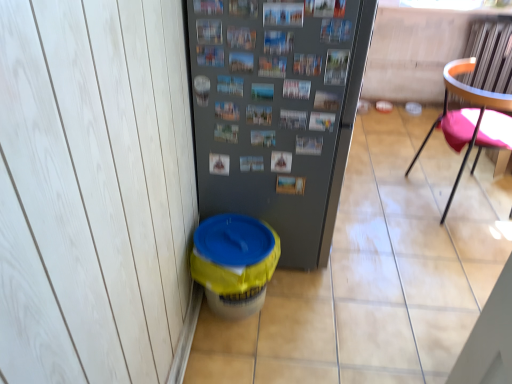
Locate an element on the screen. This screenshot has width=512, height=384. orange plastic chair at right is located at coordinates (471, 120).

Find the location of a particular element. yellow plastic potty at lower left is located at coordinates (234, 263).

At what (x,y) coordinates should I click in order to perform the action: click on orange plastic chair at right. Please return your answer as a coordinate pair (x, y). Looking at the image, I should click on (471, 120).

Would you consider yellow plastic potty at lower left to be distant from orange plastic chair at right?

yellow plastic potty at lower left is positioned a significant distance from orange plastic chair at right.

From the image's perspective, which is above, yellow plastic potty at lower left or orange plastic chair at right?

From the image's view, orange plastic chair at right is above.

Considering the positions of point (260, 222) and point (466, 61), is point (260, 222) closer or farther from the camera than point (466, 61)?

Point (260, 222) appears to be closer to the viewer than point (466, 61).

Which is correct: yellow plastic potty at lower left is inside orange plastic chair at right, or outside of it?

yellow plastic potty at lower left is not inside orange plastic chair at right, it's outside.

Looking at the image, does metallic gray refrigerator at center seem bigger or smaller compared to orange plastic chair at right?

In the image, metallic gray refrigerator at center appears to be larger than orange plastic chair at right.

Could you tell me if metallic gray refrigerator at center is facing orange plastic chair at right?

Yes.

From the image's perspective, would you say orange plastic chair at right is positioned over metallic gray refrigerator at center?

Incorrect, from the image's perspective, orange plastic chair at right is lower than metallic gray refrigerator at center.

Is orange plastic chair at right not close to metallic gray refrigerator at center?

Yes, orange plastic chair at right is far from metallic gray refrigerator at center.

Can you tell me how much orange plastic chair at right and metallic gray refrigerator at center differ in facing direction?

The angle between the facing direction of orange plastic chair at right and the facing direction of metallic gray refrigerator at center is 11.5 degrees.

Is orange plastic chair at right turned away from metallic gray refrigerator at center?

That's right, orange plastic chair at right is facing away from metallic gray refrigerator at center.

Which object is positioned more to the right, orange plastic chair at right or yellow plastic potty at lower left?

From the viewer's perspective, orange plastic chair at right appears more on the right side.

Is orange plastic chair at right positioned with its back to yellow plastic potty at lower left?

Yes.

Measure the distance from orange plastic chair at right to yellow plastic potty at lower left.

orange plastic chair at right is 4.05 feet from yellow plastic potty at lower left.

Which is more distant, (453, 133) or (252, 280)?

The point (453, 133) is farther.

Is yellow plastic potty at lower left aimed at metallic gray refrigerator at center?

No.

Considering the sizes of objects yellow plastic potty at lower left and metallic gray refrigerator at center in the image provided, who is bigger, yellow plastic potty at lower left or metallic gray refrigerator at center?

metallic gray refrigerator at center is bigger.

From a real-world perspective, is yellow plastic potty at lower left located higher than metallic gray refrigerator at center?

Incorrect, from a real-world perspective, yellow plastic potty at lower left is lower than metallic gray refrigerator at center.

Is point (198, 245) more distant than point (370, 16)?

That is True.

Which point is more forward, (347, 148) or (234, 300)?

Positioned in front is point (347, 148).

Considering the relative positions of metallic gray refrigerator at center and yellow plastic potty at lower left in the image provided, is metallic gray refrigerator at center in front of yellow plastic potty at lower left?

Yes.

From a real-world perspective, is metallic gray refrigerator at center positioned above or below yellow plastic potty at lower left?

Clearly, from a real-world perspective, metallic gray refrigerator at center is above yellow plastic potty at lower left.

Which of these two, metallic gray refrigerator at center or yellow plastic potty at lower left, is bigger?

With larger size is metallic gray refrigerator at center.

Identify the location of chair that appears above the yellow plastic potty at lower left (from the image's perspective). The height and width of the screenshot is (384, 512). (471, 120).

This screenshot has width=512, height=384. I want to click on chair that is under the metallic gray refrigerator at center (from a real-world perspective), so click(x=471, y=120).

Considering their positions, is orange plastic chair at right positioned closer to metallic gray refrigerator at center than yellow plastic potty at lower left?

yellow plastic potty at lower left.

Based on their spatial positions, is yellow plastic potty at lower left or metallic gray refrigerator at center closer to orange plastic chair at right?

metallic gray refrigerator at center is positioned closer to the anchor orange plastic chair at right.

When comparing their distances from orange plastic chair at right, does metallic gray refrigerator at center or yellow plastic potty at lower left seem further?

yellow plastic potty at lower left is further to orange plastic chair at right.

Considering their positions, is yellow plastic potty at lower left positioned further to metallic gray refrigerator at center than orange plastic chair at right?

orange plastic chair at right lies further to metallic gray refrigerator at center than the other object.

Looking at the image, which one is located closer to yellow plastic potty at lower left, metallic gray refrigerator at center or orange plastic chair at right?

metallic gray refrigerator at center is closer to yellow plastic potty at lower left.

Looking at the image, which one is located further to yellow plastic potty at lower left, orange plastic chair at right or metallic gray refrigerator at center?

orange plastic chair at right lies further to yellow plastic potty at lower left than the other object.

Locate an element on the screen. This screenshot has height=384, width=512. refrigerator located between yellow plastic potty at lower left and orange plastic chair at right in the left-right direction is located at coordinates tap(277, 111).